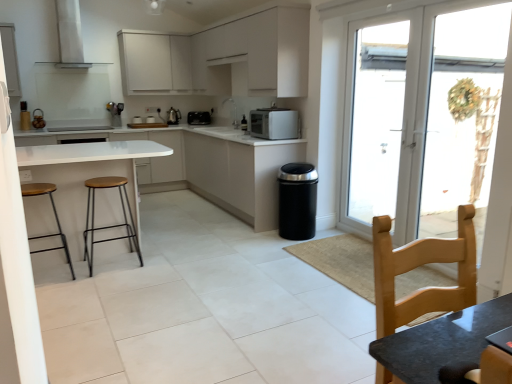
Question: From the image's perspective, is light wood chair at lower right positioned above or below wooden seat stool at left, positioned as the 2th stool in right-to-left order?

Choices:
 (A) below
 (B) above

Answer: (A)

Question: From a real-world perspective, is light wood chair at lower right above or below wooden seat stool at left, placed as the first stool when sorted from left to right?

Choices:
 (A) above
 (B) below

Answer: (A)

Question: Which object is positioned farthest from the white matte cabinet at center, marked as the 2th cabinetry in a bottom-to-top arrangement?

Choices:
 (A) white glossy exhaust hood at upper center
 (B) satin black toaster at center, the second kitchen appliance ordered from the bottom
 (C) light wood chair at lower right
 (D) transparent glass door at right
 (E) satin silver microwave at center, the 1th kitchen appliance viewed from the front

Answer: (C)

Question: Based on their relative distances, which object is nearer to the transparent glass door at right?

Choices:
 (A) wooden seat and metal frame stool at left, positioned as the 2th stool in left-to-right order
 (B) light wood chair at lower right
 (C) white plastic screen door at right
 (D) satin silver microwave at center, the 1th kitchen appliance viewed from the front
 (E) white glossy table at center

Answer: (C)